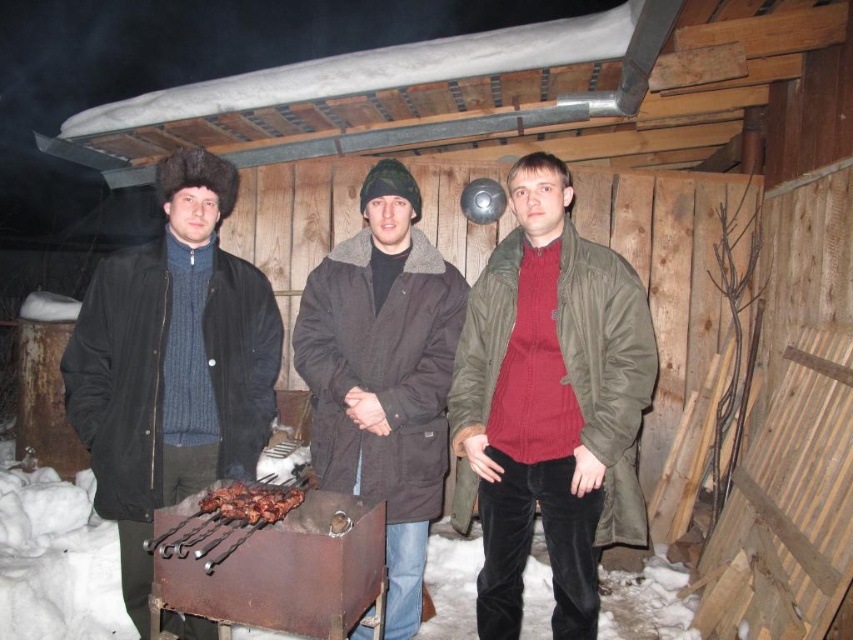
Does dark brown fur hat at left have a greater width compared to brown charred skewers at center?

Yes, dark brown fur hat at left is wider than brown charred skewers at center.

Can you confirm if dark brown fur hat at left is positioned to the left of brown charred skewers at center?

Correct, you'll find dark brown fur hat at left to the left of brown charred skewers at center.

Between point (227, 198) and point (200, 509), which one is positioned behind?

Point (227, 198)

At what (x,y) coordinates should I click in order to perform the action: click on dark brown fur hat at left. Please return your answer as a coordinate pair (x, y). Looking at the image, I should click on (172, 364).

Can you confirm if olive green jacket at center is shorter than dark brown fur-lined coat at center?

Yes.

Does olive green jacket at center have a greater width compared to dark brown fur-lined coat at center?

No, olive green jacket at center is not wider than dark brown fur-lined coat at center.

The height and width of the screenshot is (640, 853). Describe the element at coordinates (549, 404) in the screenshot. I see `olive green jacket at center` at that location.

Where is `olive green jacket at center`? This screenshot has height=640, width=853. olive green jacket at center is located at coordinates (549, 404).

Image resolution: width=853 pixels, height=640 pixels. What do you see at coordinates (383, 374) in the screenshot?
I see `dark brown fur-lined coat at center` at bounding box center [383, 374].

Who is lower down, dark brown fur-lined coat at center or brown charred skewers at center?

brown charred skewers at center is below.

Does point (321, 300) come closer to viewer compared to point (242, 484)?

No, (321, 300) is behind (242, 484).

Identify the location of dark brown fur-lined coat at center. The image size is (853, 640). (383, 374).